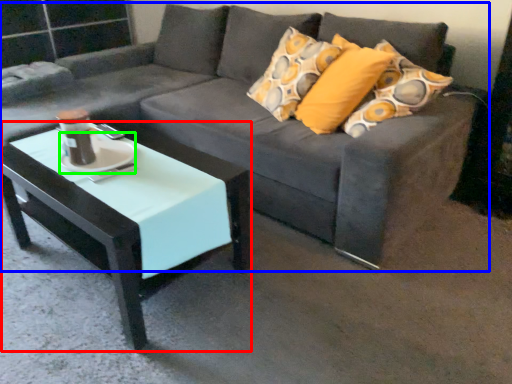
Question: Based on their relative distances, which object is farther from coffee table (highlighted by a red box)? Choose from studio couch (highlighted by a blue box) and saucer (highlighted by a green box).

Choices:
 (A) studio couch
 (B) saucer

Answer: (A)